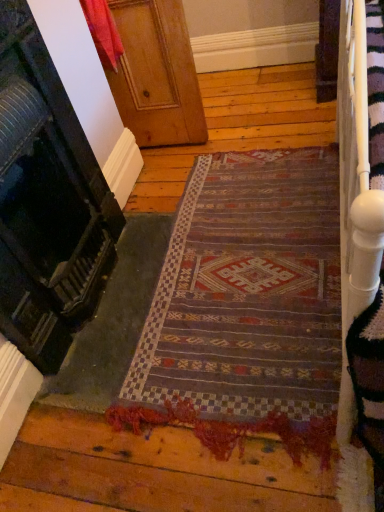
Question: Is textured woolen mat at center shorter than wooden door at upper center, the 1th door in the bottom-to-top sequence?

Choices:
 (A) no
 (B) yes

Answer: (B)

Question: From a real-world perspective, is textured woolen mat at center positioned under wooden door at upper center, the 1th door in the bottom-to-top sequence, based on gravity?

Choices:
 (A) yes
 (B) no

Answer: (A)

Question: Is textured woolen mat at center closer to camera compared to wooden door at upper center, the 1th door in the bottom-to-top sequence?

Choices:
 (A) yes
 (B) no

Answer: (B)

Question: Are textured woolen mat at center and wooden door at upper center, the 1th door in the bottom-to-top sequence, located far from each other?

Choices:
 (A) no
 (B) yes

Answer: (A)

Question: Is wooden door at upper center, the second door viewed from the top, located within textured woolen mat at center?

Choices:
 (A) yes
 (B) no

Answer: (B)

Question: Is textured woolen mat at center turned away from wooden door at upper center, the 1th door in the bottom-to-top sequence?

Choices:
 (A) no
 (B) yes

Answer: (A)

Question: Is wooden door at upper center, the 1th door in the bottom-to-top sequence, outside textured woolen mat at center?

Choices:
 (A) no
 (B) yes

Answer: (B)

Question: Are wooden door at upper center, the 1th door in the bottom-to-top sequence, and textured woolen mat at center making contact?

Choices:
 (A) yes
 (B) no

Answer: (B)

Question: Considering the relative sizes of wooden door at upper center, the second door viewed from the top, and textured woolen mat at center in the image provided, is wooden door at upper center, the second door viewed from the top, wider than textured woolen mat at center?

Choices:
 (A) yes
 (B) no

Answer: (B)

Question: Does wooden door at upper center, the second door viewed from the top, come in front of textured woolen mat at center?

Choices:
 (A) yes
 (B) no

Answer: (A)

Question: From the image's perspective, is wooden door at upper center, the second door viewed from the top, located above textured woolen mat at center?

Choices:
 (A) no
 (B) yes

Answer: (B)

Question: Is wooden door at upper center, the 1th door in the bottom-to-top sequence, to the right of textured woolen mat at center from the viewer's perspective?

Choices:
 (A) no
 (B) yes

Answer: (A)

Question: Is wooden door at upper center, the second door viewed from the top, smaller than wooden at left, which is the second door in bottom-to-top order?

Choices:
 (A) yes
 (B) no

Answer: (B)